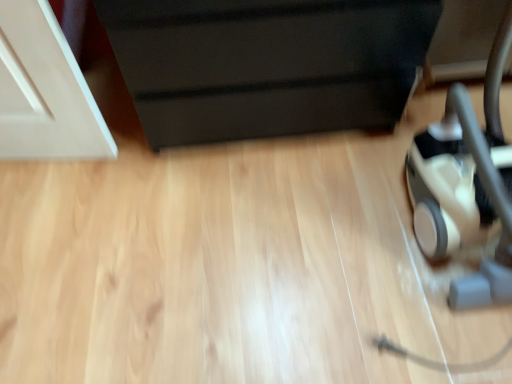
Question: From the image's perspective, relative to beige rubber baby carriage at lower right, is black matte drawer at upper center above or below?

Choices:
 (A) below
 (B) above

Answer: (B)

Question: In the image, is black matte drawer at upper center on the left side or the right side of beige rubber baby carriage at lower right?

Choices:
 (A) left
 (B) right

Answer: (A)

Question: Is point (320, 97) closer or farther from the camera than point (487, 182)?

Choices:
 (A) farther
 (B) closer

Answer: (A)

Question: From a real-world perspective, is beige rubber baby carriage at lower right positioned above or below black matte drawer at upper center?

Choices:
 (A) above
 (B) below

Answer: (A)

Question: From the image's perspective, relative to black matte drawer at upper center, is beige rubber baby carriage at lower right above or below?

Choices:
 (A) below
 (B) above

Answer: (A)

Question: In the image, is beige rubber baby carriage at lower right on the left side or the right side of black matte drawer at upper center?

Choices:
 (A) right
 (B) left

Answer: (A)

Question: Is beige rubber baby carriage at lower right taller or shorter than black matte drawer at upper center?

Choices:
 (A) tall
 (B) short

Answer: (A)